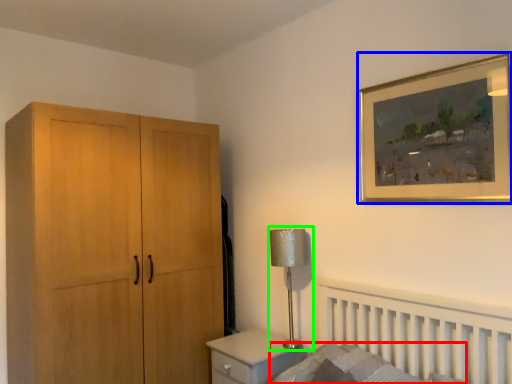
Question: Which object is the closest to the mattress (highlighted by a red box)? Choose among these: picture frame (highlighted by a blue box) or table lamp (highlighted by a green box).

Choices:
 (A) picture frame
 (B) table lamp

Answer: (B)